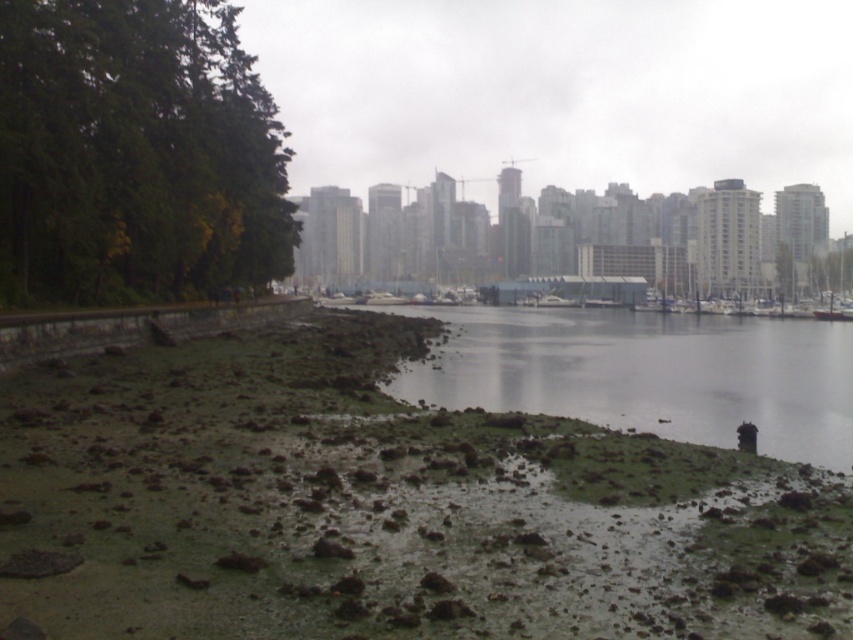
At what (x,y) coordinates should I click in order to perform the action: click on green leafy trees at left. Please return your answer as a coordinate pair (x, y). The height and width of the screenshot is (640, 853). Looking at the image, I should click on (135, 154).

Is green leafy trees at left to the left of green mossy mud at lower center from the viewer's perspective?

Indeed, green leafy trees at left is positioned on the left side of green mossy mud at lower center.

The image size is (853, 640). What do you see at coordinates (135, 154) in the screenshot?
I see `green leafy trees at left` at bounding box center [135, 154].

The height and width of the screenshot is (640, 853). Identify the location of green leafy trees at left. (135, 154).

The height and width of the screenshot is (640, 853). Describe the element at coordinates (647, 372) in the screenshot. I see `green mossy mud at lower center` at that location.

Is green mossy mud at lower center to the right of white glossy boat at center from the viewer's perspective?

Yes, green mossy mud at lower center is to the right of white glossy boat at center.

Locate an element on the screen. green mossy mud at lower center is located at coordinates (647, 372).

Who is shorter, green leafy trees at left or white glossy boat at center?

white glossy boat at center

Who is more distant from viewer, (x=44, y=45) or (x=376, y=298)?

The point (x=376, y=298) is more distant.

The width and height of the screenshot is (853, 640). I want to click on green leafy trees at left, so click(x=135, y=154).